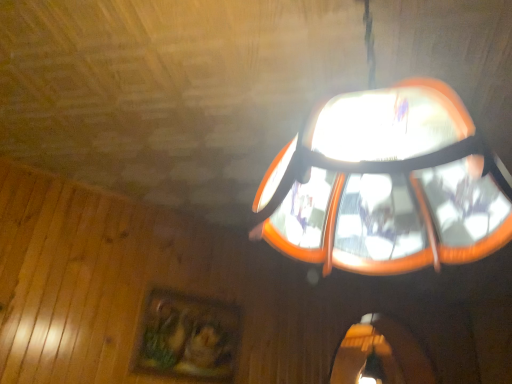
Find the location of a particular element. orange plastic lampshade at upper center is located at coordinates (440, 339).

Measure the distance between orange plastic lampshade at upper center and camera.

They are 2.33 meters apart.

The width and height of the screenshot is (512, 384). Describe the element at coordinates (440, 339) in the screenshot. I see `orange plastic lampshade at upper center` at that location.

In order to face orange plastic lampshade at upper center, should I rotate leftwards or rightwards?

Turn right approximately 14.861 degrees to face it.

The image size is (512, 384). What do you see at coordinates (187, 337) in the screenshot?
I see `wooden painted picture frame at lower left` at bounding box center [187, 337].

Measure the distance between wooden painted picture frame at lower left and camera.

The distance of wooden painted picture frame at lower left from camera is 1.93 meters.

Identify the location of wooden painted picture frame at lower left. The height and width of the screenshot is (384, 512). click(187, 337).

Where is `orange plastic lampshade at upper center`? The height and width of the screenshot is (384, 512). orange plastic lampshade at upper center is located at coordinates (440, 339).

Which object is positioned more to the right, wooden painted picture frame at lower left or orange plastic lampshade at upper center?

orange plastic lampshade at upper center is more to the right.

Between wooden painted picture frame at lower left and orange plastic lampshade at upper center, which one is positioned in front?

orange plastic lampshade at upper center is closer to the camera.

Considering the positions of point (182, 361) and point (311, 225), is point (182, 361) closer or farther from the camera than point (311, 225)?

Point (182, 361) is positioned farther from the camera compared to point (311, 225).

From the image's perspective, which object appears higher, wooden painted picture frame at lower left or orange plastic lampshade at upper center?

orange plastic lampshade at upper center.

From a real-world perspective, which is physically below, wooden painted picture frame at lower left or orange plastic lampshade at upper center?

Answer: wooden painted picture frame at lower left is physically lower.

Which of these two, wooden painted picture frame at lower left or orange plastic lampshade at upper center, is thinner?

With smaller width is wooden painted picture frame at lower left.

Looking at this image, considering the sizes of objects wooden painted picture frame at lower left and orange plastic lampshade at upper center in the image provided, who is shorter, wooden painted picture frame at lower left or orange plastic lampshade at upper center?

wooden painted picture frame at lower left.

Can you confirm if wooden painted picture frame at lower left is smaller than orange plastic lampshade at upper center?

Indeed, wooden painted picture frame at lower left has a smaller size compared to orange plastic lampshade at upper center.

Would you say wooden painted picture frame at lower left contains orange plastic lampshade at upper center?

Actually, orange plastic lampshade at upper center is outside wooden painted picture frame at lower left.

Is wooden painted picture frame at lower left far from orange plastic lampshade at upper center?

Yes.

Is wooden painted picture frame at lower left oriented towards orange plastic lampshade at upper center?

Yes, wooden painted picture frame at lower left is oriented towards orange plastic lampshade at upper center.

What's the angular difference between wooden painted picture frame at lower left and orange plastic lampshade at upper center's facing directions?

92.8 degrees separate the facing orientations of wooden painted picture frame at lower left and orange plastic lampshade at upper center.

Locate an element on the screen. This screenshot has height=384, width=512. lamp above the wooden painted picture frame at lower left (from the image's perspective) is located at coordinates (440, 339).

Which is more to the left, orange plastic lampshade at upper center or wooden painted picture frame at lower left?

wooden painted picture frame at lower left is more to the left.

Is orange plastic lampshade at upper center in front of or behind wooden painted picture frame at lower left in the image?

orange plastic lampshade at upper center is positioned closer to the viewer than wooden painted picture frame at lower left.

Which point is more forward, (472,381) or (167,361)?

Point (167,361)

From the image's perspective, is orange plastic lampshade at upper center above or below wooden painted picture frame at lower left?

Based on their image positions, orange plastic lampshade at upper center is located above wooden painted picture frame at lower left.

From a real-world perspective, which is physically below, orange plastic lampshade at upper center or wooden painted picture frame at lower left?

wooden painted picture frame at lower left.

Which of these two, orange plastic lampshade at upper center or wooden painted picture frame at lower left, is wider?

With larger width is orange plastic lampshade at upper center.

From their relative heights in the image, would you say orange plastic lampshade at upper center is taller or shorter than wooden painted picture frame at lower left?

In the image, orange plastic lampshade at upper center appears to be taller than wooden painted picture frame at lower left.

Looking at this image, which of these two, orange plastic lampshade at upper center or wooden painted picture frame at lower left, is smaller?

wooden painted picture frame at lower left.

Is orange plastic lampshade at upper center positioned beyond the bounds of wooden painted picture frame at lower left?

orange plastic lampshade at upper center lies outside wooden painted picture frame at lower left's area.

Is orange plastic lampshade at upper center not close to wooden painted picture frame at lower left?

orange plastic lampshade at upper center is far away from wooden painted picture frame at lower left.

Is orange plastic lampshade at upper center oriented away from wooden painted picture frame at lower left?

That's not correct — orange plastic lampshade at upper center is not looking away from wooden painted picture frame at lower left.

What's the angular difference between orange plastic lampshade at upper center and wooden painted picture frame at lower left's facing directions?

The angular difference between orange plastic lampshade at upper center and wooden painted picture frame at lower left is 92.8 degrees.

Identify the location of picture frame that is behind the orange plastic lampshade at upper center. Image resolution: width=512 pixels, height=384 pixels. (187, 337).

Find the location of a particular element. picture frame beneath the orange plastic lampshade at upper center (from a real-world perspective) is located at coordinates (187, 337).

At what (x,y) coordinates should I click in order to perform the action: click on picture frame on the left of orange plastic lampshade at upper center. Please return your answer as a coordinate pair (x, y). This screenshot has width=512, height=384. Looking at the image, I should click on (187, 337).